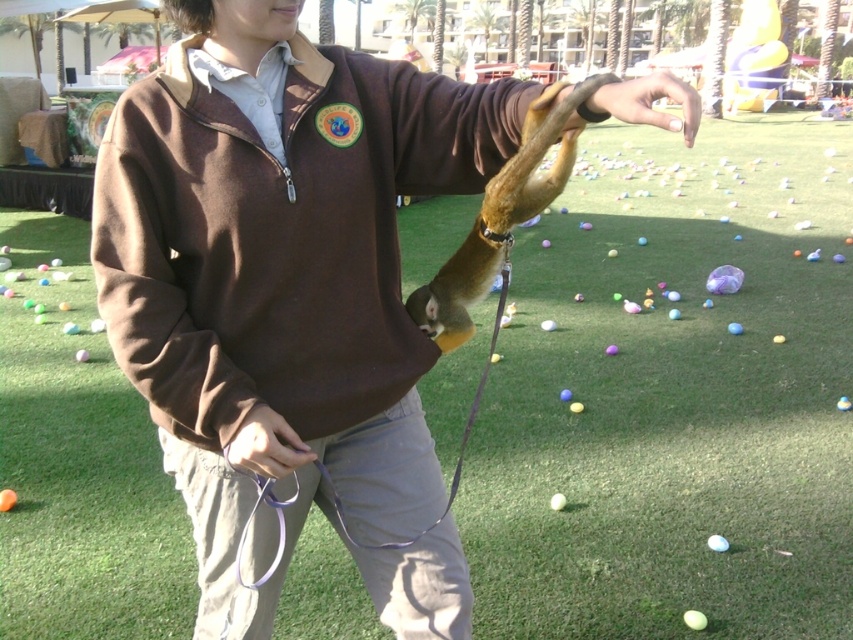
Question: Does brown fleece sweater at center appear on the right side of nail polish at center?

Choices:
 (A) no
 (B) yes

Answer: (A)

Question: Does brown fleece sweater at center have a smaller size compared to nail polish at center?

Choices:
 (A) yes
 (B) no

Answer: (B)

Question: Is brown fleece sweater at center above nail polish at center?

Choices:
 (A) yes
 (B) no

Answer: (B)

Question: Which point appears closest to the camera in this image?

Choices:
 (A) (312, 180)
 (B) (637, 99)

Answer: (B)

Question: Among these objects, which one is nearest to the camera?

Choices:
 (A) brown fleece sweater at center
 (B) nail polish at center

Answer: (B)